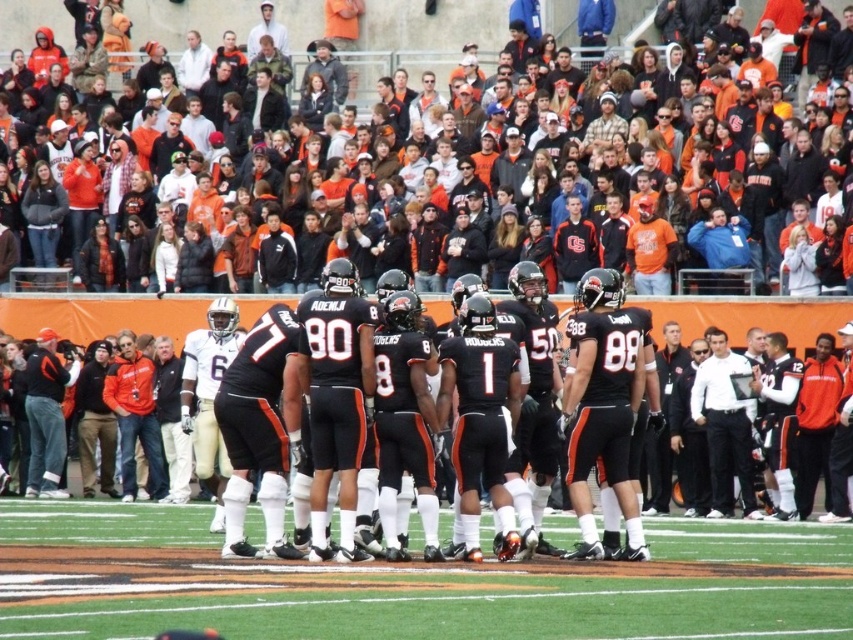
You are a photographer standing at the center of the field during a football game. You want to take a photo of the two points marked in the image. Which point, point (155, 24) or point (128, 308), will appear closer to you in the photo?

Point (155, 24) is further to the viewer than point (128, 308), so the point (128, 308) will appear closer to you in the photo.